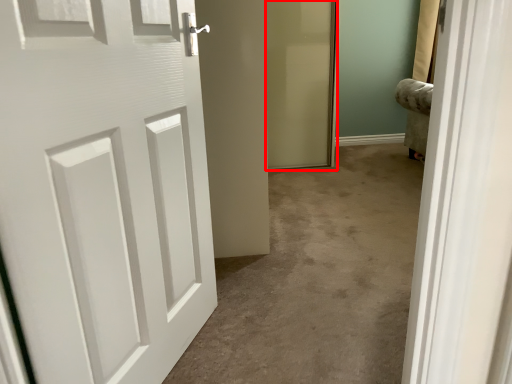
Question: Considering the relative positions of screen door (annotated by the red box) and door in the image provided, where is screen door (annotated by the red box) located with respect to the staircase?

Choices:
 (A) right
 (B) left

Answer: (A)